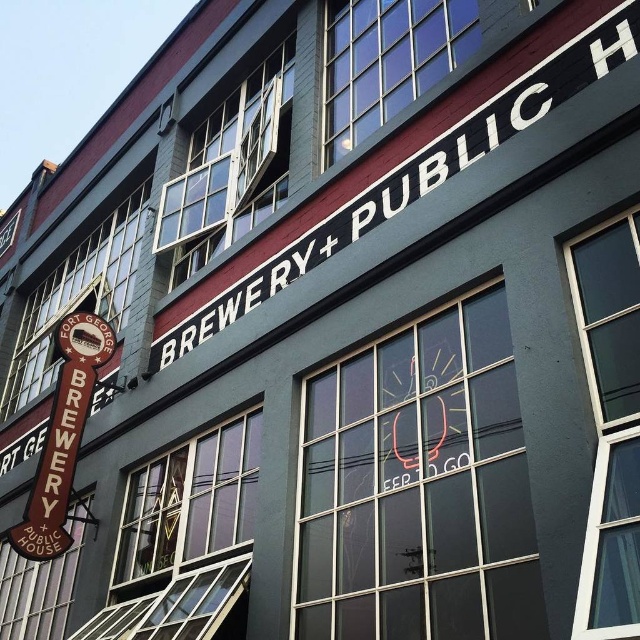
Question: Which point is farther from the camera taking this photo?

Choices:
 (A) (56, 550)
 (B) (564, 97)

Answer: (A)

Question: Which point is farther from the camera taking this photo?

Choices:
 (A) (189, 324)
 (B) (61, 317)

Answer: (B)

Question: Is white painted signboard at center smaller than brown wooden sign at left?

Choices:
 (A) no
 (B) yes

Answer: (B)

Question: Can you confirm if white painted signboard at center is bigger than brown wooden sign at left?

Choices:
 (A) yes
 (B) no

Answer: (B)

Question: Is white painted signboard at center wider than brown wooden sign at left?

Choices:
 (A) no
 (B) yes

Answer: (B)